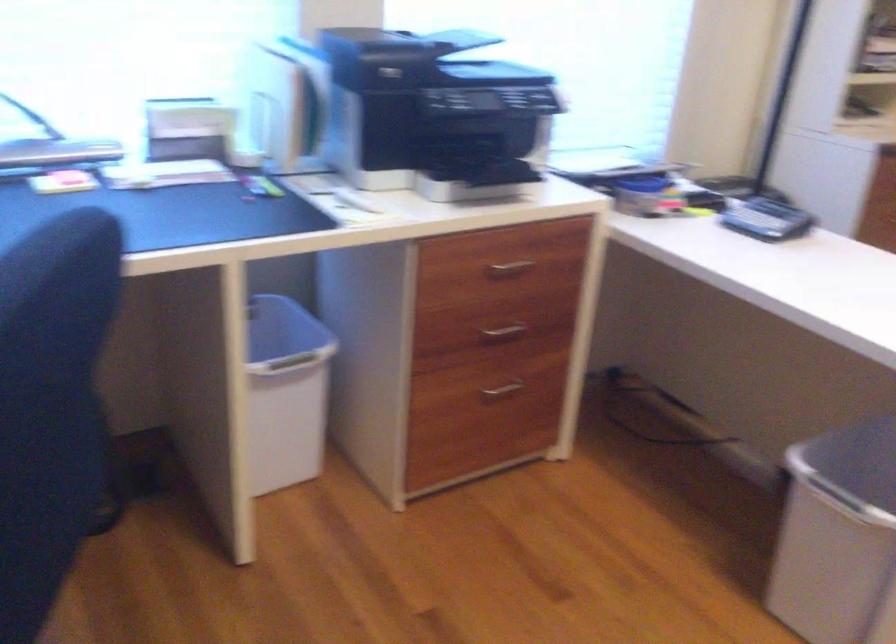
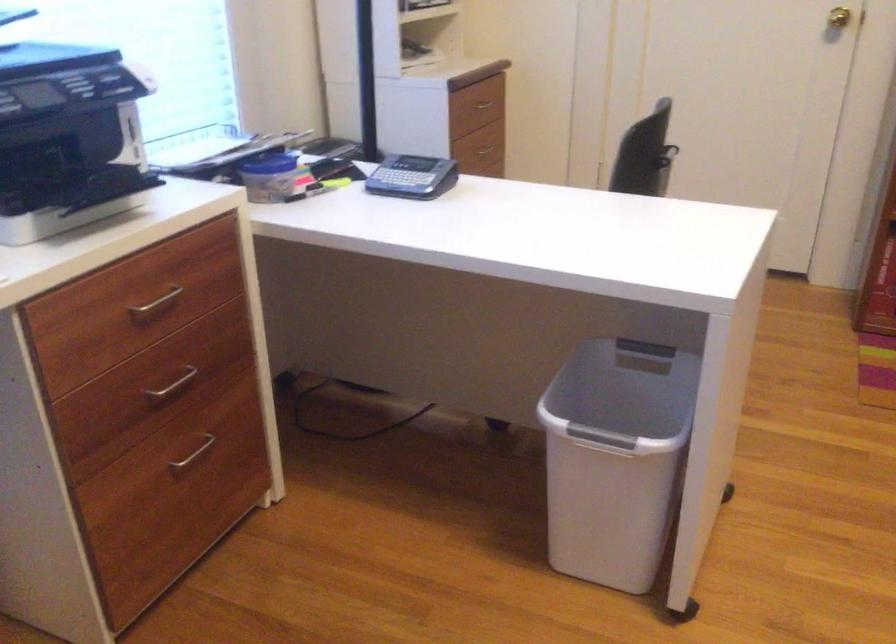
Find the pixel in the second image that matches point 503,330 in the first image.

(173, 384)